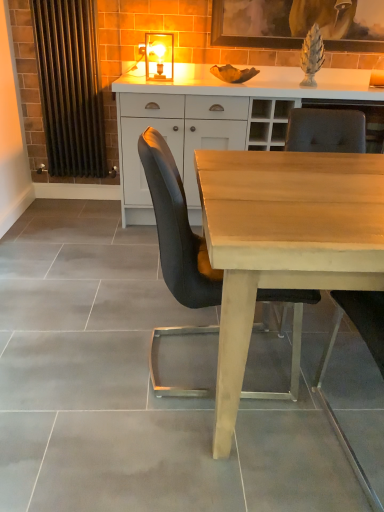
Locate an element on the screen. This screenshot has height=512, width=384. free space above light brown wood desk at center (from a real-world perspective) is located at coordinates (312, 185).